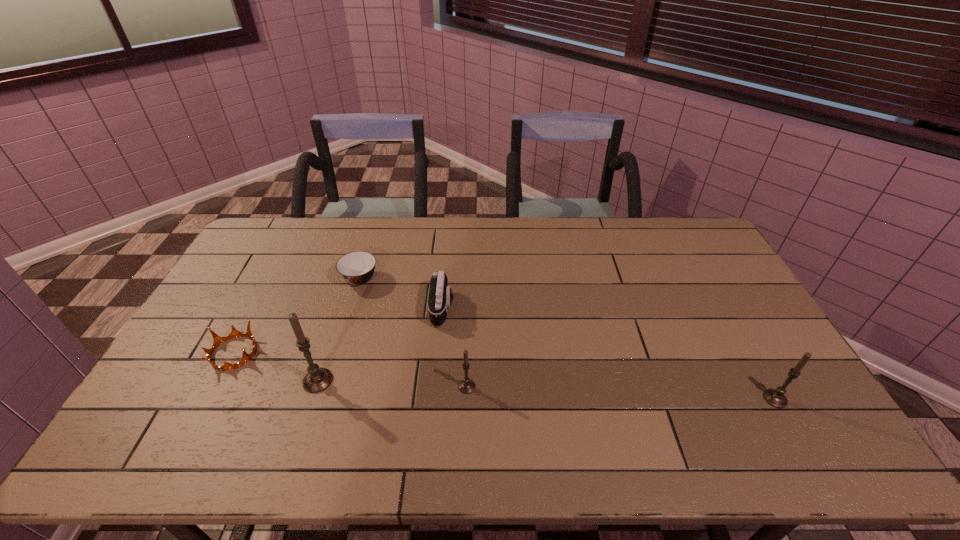
Where is `vacant space in between the tallest candle and the second tallest object`? vacant space in between the tallest candle and the second tallest object is located at coordinates (546, 390).

The width and height of the screenshot is (960, 540). In order to click on unoccupied area between the fourth tallest object and the crown in this screenshot , I will do `click(338, 330)`.

Image resolution: width=960 pixels, height=540 pixels. I want to click on vacant space that's between the second shortest candle and the fourth object from left to right, so click(609, 353).

Locate an element on the screen. object that can be found as the fourth closest to the rightmost object is located at coordinates (357, 268).

Locate which object is the closest to the fourth object from left to right. Please provide its 2D coordinates. Your answer should be formatted as a tuple, i.e. [(x, y)], where the tuple contains the x and y coordinates of a point satisfying the conditions above.

[(466, 386)]

Identify which candle is located as the second nearest to the fourth tallest object. Please provide its 2D coordinates. Your answer should be formatted as a tuple, i.e. [(x, y)], where the tuple contains the x and y coordinates of a point satisfying the conditions above.

[(317, 379)]

Find the location of `candle that is the closest to the tallest object`. candle that is the closest to the tallest object is located at coordinates (466, 386).

At what (x,y) coordinates should I click in order to perform the action: click on vacant region that satisfies the following two spatial constraints: 1. on the front lens of the third shortest object; 2. on the left side of the second candle from right to left. Please return your answer as a coordinate pair (x, y). This screenshot has width=960, height=540. Looking at the image, I should click on (436, 387).

The image size is (960, 540). I want to click on free space that satisfies the following two spatial constraints: 1. on the front side of the leftmost candle; 2. on the left side of the leftmost object, so click(x=220, y=381).

Where is `vacant position in the image that satisfies the following two spatial constraints: 1. on the front side of the tallest object; 2. on the right side of the fifth shortest object`? This screenshot has width=960, height=540. vacant position in the image that satisfies the following two spatial constraints: 1. on the front side of the tallest object; 2. on the right side of the fifth shortest object is located at coordinates (312, 399).